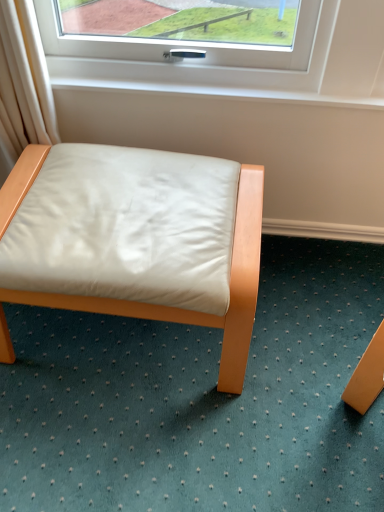
What are the coordinates of `vacant space to the right of white leather ottoman at center` in the screenshot? It's located at (313, 320).